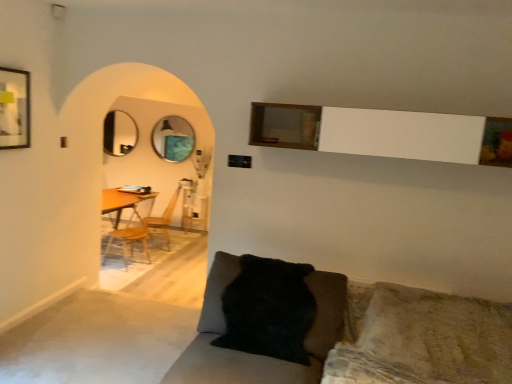
Question: Is wooden armchair at center closer to camera compared to black fuzzy pillow at lower center?

Choices:
 (A) no
 (B) yes

Answer: (A)

Question: Is wooden armchair at center shorter than black fuzzy pillow at lower center?

Choices:
 (A) yes
 (B) no

Answer: (B)

Question: Is wooden armchair at center taller than black fuzzy pillow at lower center?

Choices:
 (A) yes
 (B) no

Answer: (A)

Question: Are wooden armchair at center and black fuzzy pillow at lower center beside each other?

Choices:
 (A) yes
 (B) no

Answer: (B)

Question: Is wooden armchair at center oriented away from black fuzzy pillow at lower center?

Choices:
 (A) yes
 (B) no

Answer: (B)

Question: From a real-world perspective, relative to wooden armchair at center, is matte black picture frame at upper left vertically above or below?

Choices:
 (A) above
 (B) below

Answer: (A)

Question: Would you say matte black picture frame at upper left is inside or outside wooden armchair at center?

Choices:
 (A) outside
 (B) inside

Answer: (A)

Question: From their relative heights in the image, would you say matte black picture frame at upper left is taller or shorter than wooden armchair at center?

Choices:
 (A) short
 (B) tall

Answer: (A)

Question: In terms of width, does matte black picture frame at upper left look wider or thinner when compared to wooden armchair at center?

Choices:
 (A) thin
 (B) wide

Answer: (A)

Question: From a real-world perspective, is wooden at left positioned above or below matte black picture frame at upper left?

Choices:
 (A) above
 (B) below

Answer: (B)

Question: Considering their positions, is wooden at left located in front of or behind matte black picture frame at upper left?

Choices:
 (A) behind
 (B) front

Answer: (A)

Question: In terms of size, does wooden at left appear bigger or smaller than matte black picture frame at upper left?

Choices:
 (A) big
 (B) small

Answer: (A)

Question: Is wooden at left inside or outside of matte black picture frame at upper left?

Choices:
 (A) inside
 (B) outside

Answer: (B)

Question: From a real-world perspective, is matte silver mirror at left, which is the second mirror from right to left, above or below black fuzzy pillow at lower center?

Choices:
 (A) above
 (B) below

Answer: (A)

Question: Based on their positions, is matte silver mirror at left, placed as the first mirror when sorted from left to right, located to the left or right of black fuzzy pillow at lower center?

Choices:
 (A) left
 (B) right

Answer: (A)